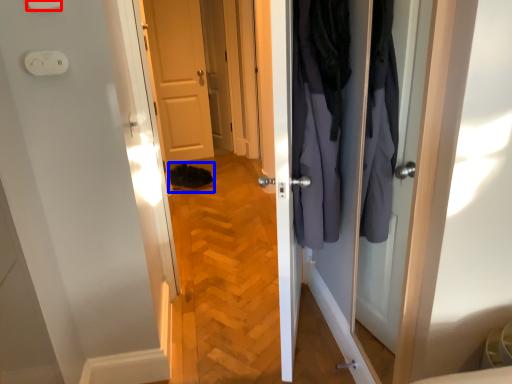
Question: Which object is further to the camera taking this photo, light switch (highlighted by a red box) or shoe (highlighted by a blue box)?

Choices:
 (A) light switch
 (B) shoe

Answer: (B)